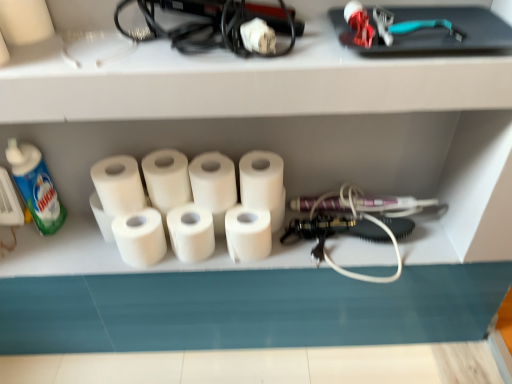
Question: In terms of size, does white matte toilet paper at center, which is the 4th toilet paper in left-to-right order, appear bigger or smaller than white matte toilet paper at center, acting as the second toilet paper starting from the left?

Choices:
 (A) small
 (B) big

Answer: (B)

Question: Does point (223, 210) appear closer or farther from the camera than point (158, 231)?

Choices:
 (A) closer
 (B) farther

Answer: (B)

Question: Estimate the real-world distances between objects in this image. Which object is closer to the white matte toilet paper at center, marked as the 5th toilet paper in a left-to-right arrangement?

Choices:
 (A) white matte toilet paper at center, which appears as the fourth toilet paper when viewed from the right
 (B) white matte toilet paper at center, positioned as the sixth toilet paper in left-to-right order
 (C) white matte toilet paper at center, acting as the second toilet paper starting from the left
 (D) green matte bottle at left
 (E) white matte toilet paper at center, marked as the first toilet paper in a left-to-right arrangement

Answer: (B)

Question: Estimate the real-world distances between objects in this image. Which object is closer to the white matte toilet paper at center, positioned as the sixth toilet paper in left-to-right order?

Choices:
 (A) white matte toilet paper at center, which is counted as the third toilet paper, starting from the left
 (B) white matte toilet paper at center, which ranks as the 3th toilet paper in right-to-left order
 (C) white matte toilet paper at center, the fifth toilet paper positioned from the right
 (D) green matte bottle at left
 (E) white matte toilet paper at center, marked as the 5th toilet paper in a left-to-right arrangement

Answer: (E)